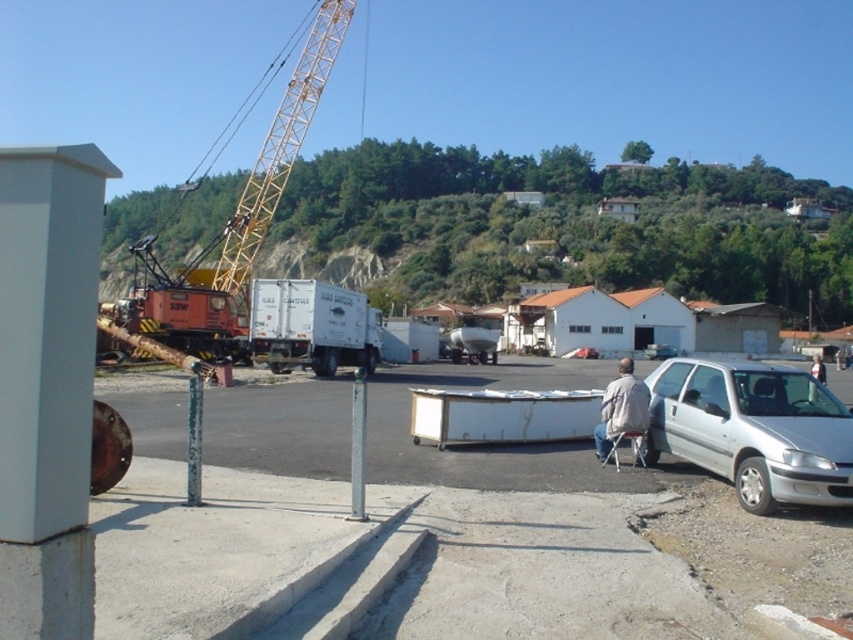
Is white matte table at center in front of silver metallic car at lower right?

No, it is behind silver metallic car at lower right.

Does white matte table at center have a greater width compared to silver metallic car at lower right?

Yes.

Describe the element at coordinates (500, 444) in the screenshot. The width and height of the screenshot is (853, 640). I see `white matte table at center` at that location.

Where is `white matte table at center`? The image size is (853, 640). white matte table at center is located at coordinates (500, 444).

Measure the distance between white matte table at center and orange metallic crane at left.

The distance of white matte table at center from orange metallic crane at left is 65.53 meters.

Is point (833, 385) closer to camera compared to point (189, 300)?

No, (833, 385) is further to viewer.

Does point (260, 428) come closer to viewer compared to point (229, 326)?

That is True.

This screenshot has height=640, width=853. Find the location of `white matte table at center`. white matte table at center is located at coordinates (500, 444).

Looking at this image, who is more forward, [456,378] or [602,406]?

Positioned in front is point [602,406].

Which of these two, white matte table at center or light gray fabric jacket at lower right, stands shorter?

With less height is white matte table at center.

Find the location of a particular element. The height and width of the screenshot is (640, 853). white matte table at center is located at coordinates (500, 444).

Identify the location of white matte table at center. (500, 444).